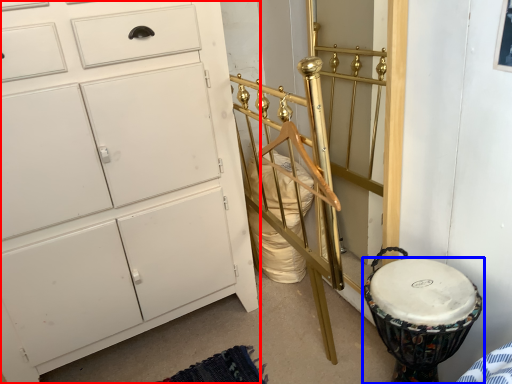
Question: Which point is further to the camera, chest of drawers (highlighted by a red box) or drum (highlighted by a blue box)?

Choices:
 (A) chest of drawers
 (B) drum

Answer: (B)